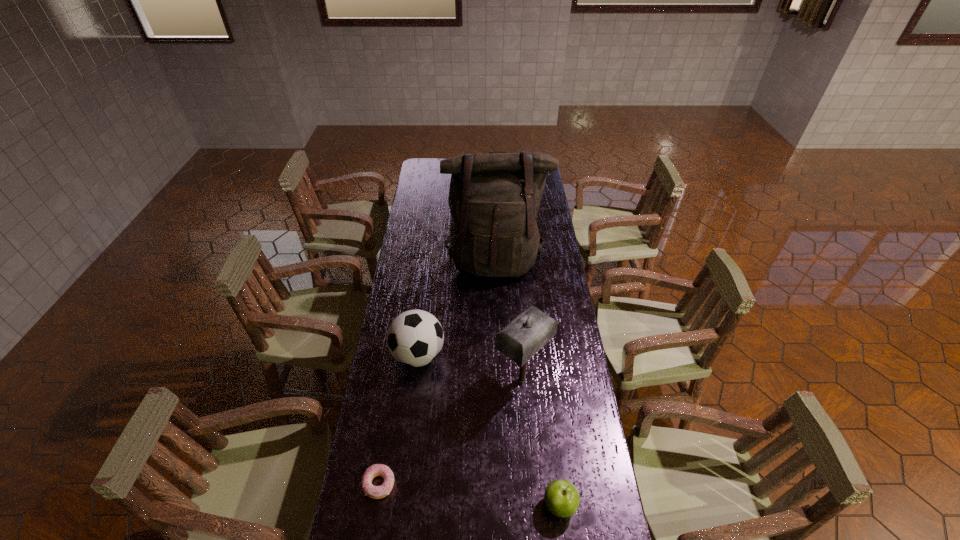
I want to click on the tallest object, so click(494, 198).

Identify the location of the farthest object. (494, 198).

Where is `the fourth shortest object`? The width and height of the screenshot is (960, 540). the fourth shortest object is located at coordinates (524, 336).

Where is `soccer ball`? The height and width of the screenshot is (540, 960). soccer ball is located at coordinates (415, 338).

Identify the location of the second shortest object. The height and width of the screenshot is (540, 960). (561, 497).

The image size is (960, 540). Identify the location of doughnut. (376, 492).

Where is `free region located on the open flap of the backpack`? The height and width of the screenshot is (540, 960). free region located on the open flap of the backpack is located at coordinates (497, 332).

At what (x,y) coordinates should I click in order to perform the action: click on free space located on the front of the mallet. Please return your answer as a coordinate pair (x, y). Looking at the image, I should click on (532, 512).

Find the location of `vacant region located on the front of the soccer ball`. vacant region located on the front of the soccer ball is located at coordinates (410, 423).

This screenshot has width=960, height=540. I want to click on free space located 0.130m on the left of the apple, so click(x=496, y=504).